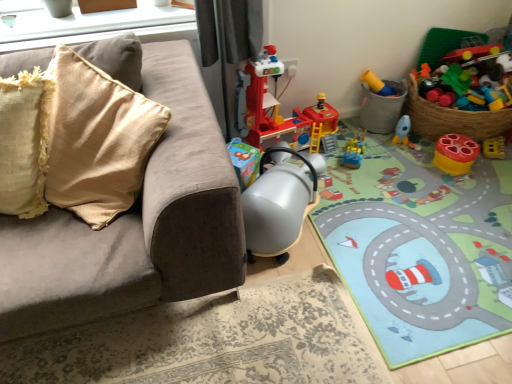
Where is `free space in front of matte plastic toy at right, the 5th toy in the left-to-right sequence`? free space in front of matte plastic toy at right, the 5th toy in the left-to-right sequence is located at coordinates (470, 185).